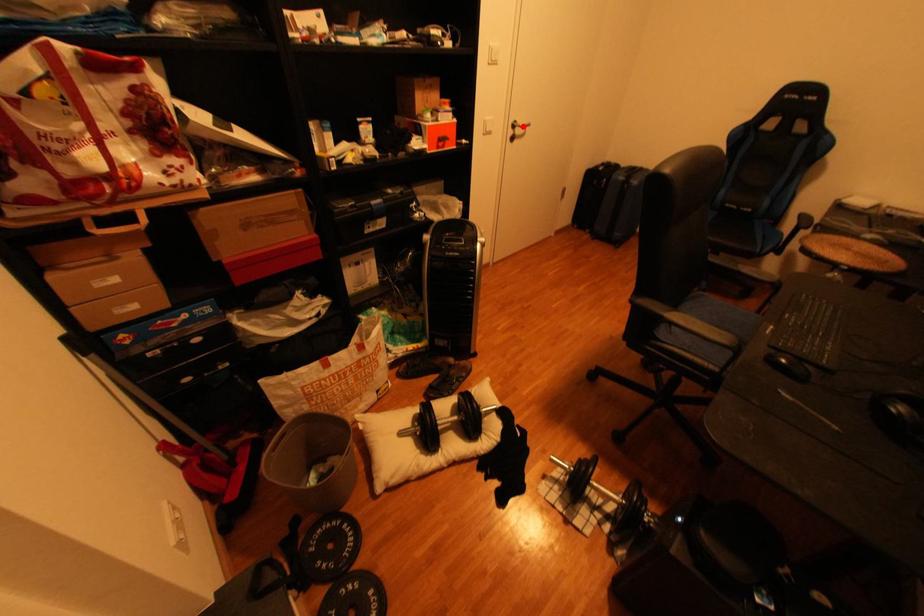
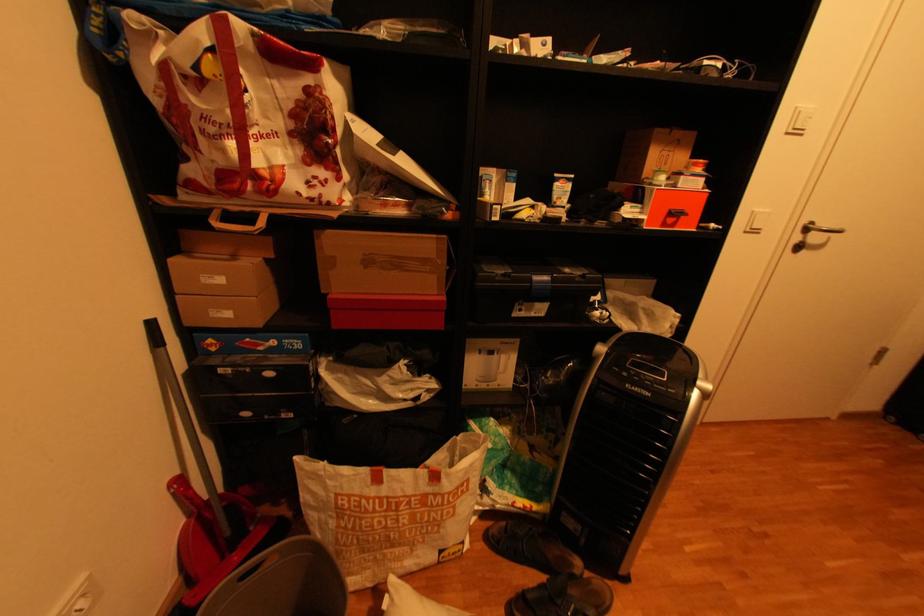
Where in the second image is the point corresponding to the highlighted location from the first image?

(816, 230)